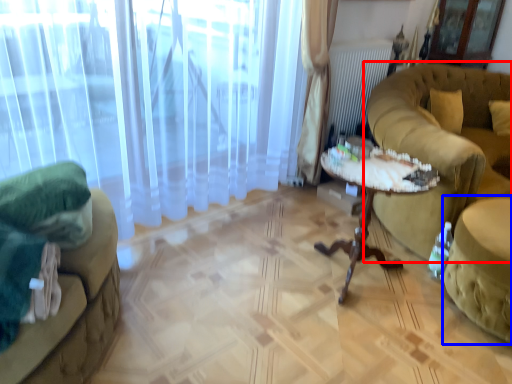
Question: Among these objects, which one is nearest to the camera, studio couch (highlighted by a red box) or swivel chair (highlighted by a blue box)?

Choices:
 (A) studio couch
 (B) swivel chair

Answer: (B)